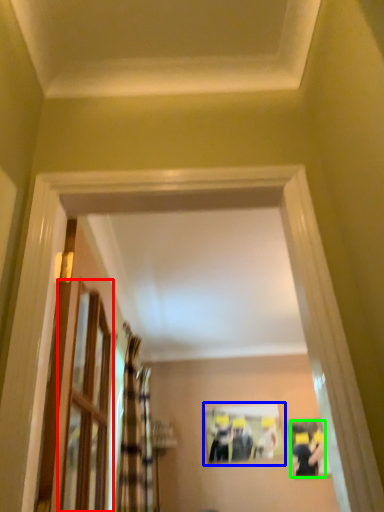
Question: Which is nearer to the glass door (highlighted by a red box)? picture frame (highlighted by a blue box) or couple (highlighted by a green box).

Choices:
 (A) picture frame
 (B) couple

Answer: (A)